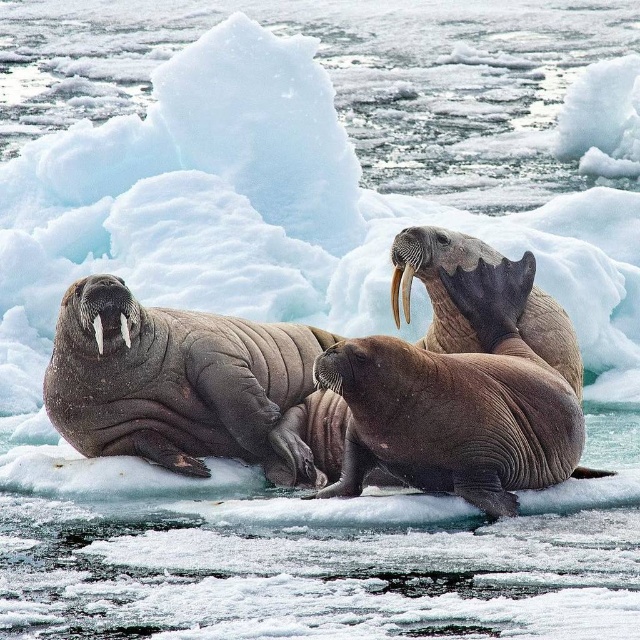
Question: Which object is the farthest from the smooth brown walrus at center?

Choices:
 (A) white matte tusk at left
 (B) smooth ivory tusk at center

Answer: (A)

Question: Among these objects, which one is nearest to the camera?

Choices:
 (A) smooth brown walrus at center
 (B) grayish-brown tusk at left
 (C) white matte tusk at left
 (D) grayish-brown wrinkled walrus at left

Answer: (C)

Question: Does white ivory tusk at center appear under smooth ivory tusk at center?

Choices:
 (A) yes
 (B) no

Answer: (B)

Question: Can you confirm if smooth ivory tusk at center is bigger than grayish-brown tusk at left?

Choices:
 (A) no
 (B) yes

Answer: (B)

Question: Does smooth brown walrus at center appear on the right side of smooth ivory tusk at center?

Choices:
 (A) yes
 (B) no

Answer: (A)

Question: Estimate the real-world distances between objects in this image. Which object is closer to the smooth brown walrus at center?

Choices:
 (A) white ivory tusk at center
 (B) smooth ivory tusk at center

Answer: (B)